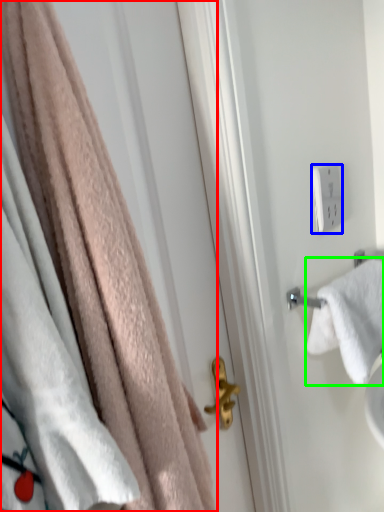
Question: Considering the real-world distances, which object is farthest from towel (highlighted by a red box)? light switch (highlighted by a blue box) or towel (highlighted by a green box)?

Choices:
 (A) light switch
 (B) towel

Answer: (A)